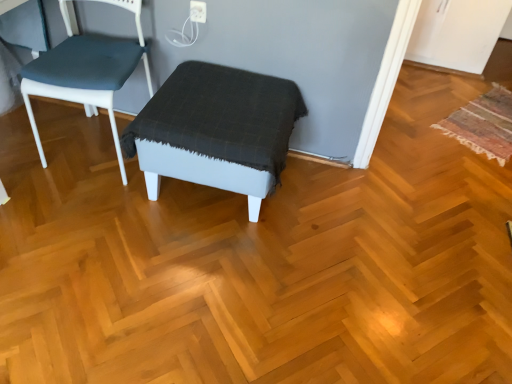
You are a GUI agent. You are given a task and a screenshot of the screen. Output one action in this format:
    pyautogui.click(x=<x>, y=<y>)
    Task: Click on the vacant space situated on the left part of matte gray stool at center
    This screenshot has height=384, width=512.
    Given the screenshot: What is the action you would take?
    pyautogui.click(x=70, y=216)